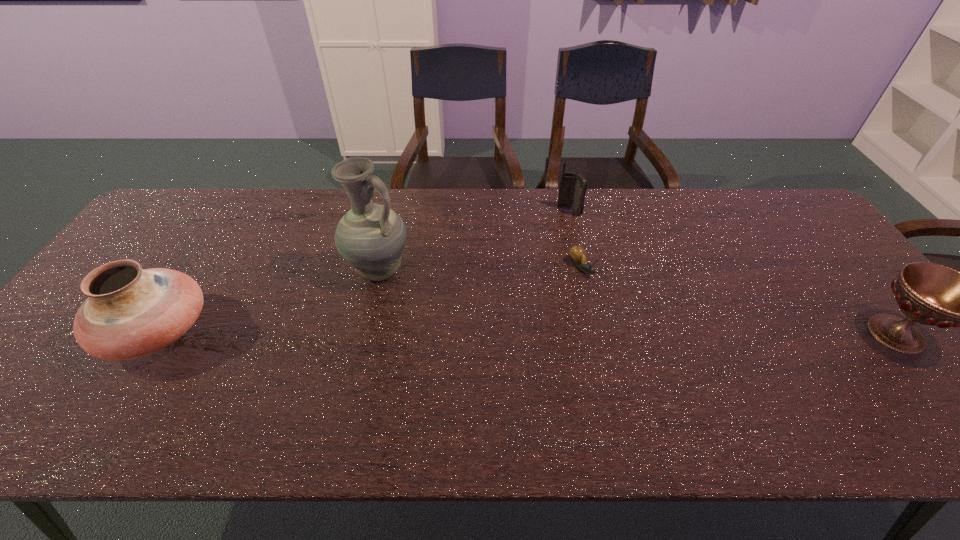
Locate an element on the screen. This screenshot has width=960, height=540. object present at the right edge is located at coordinates (931, 294).

Locate an element on the screen. This screenshot has height=540, width=960. object that is at the near left corner is located at coordinates (130, 312).

Image resolution: width=960 pixels, height=540 pixels. I want to click on vacant space at the far edge of the desktop, so click(662, 202).

The image size is (960, 540). I want to click on free spot at the near edge of the desktop, so click(582, 376).

In the image, there is a desktop. Identify the location of vacant space at the left edge. (176, 239).

Identify the location of free spot at the right edge of the desktop. (866, 356).

This screenshot has width=960, height=540. I want to click on free space at the far left corner of the desktop, so click(179, 230).

The image size is (960, 540). Find the location of `vacant space at the far right corner of the desktop`. vacant space at the far right corner of the desktop is located at coordinates (815, 230).

Image resolution: width=960 pixels, height=540 pixels. In order to click on free spot between the rightmost object and the escargot in this screenshot , I will do `click(739, 301)`.

Identify the location of vacant space in between the farthest object and the fourth object from right to left. (474, 240).